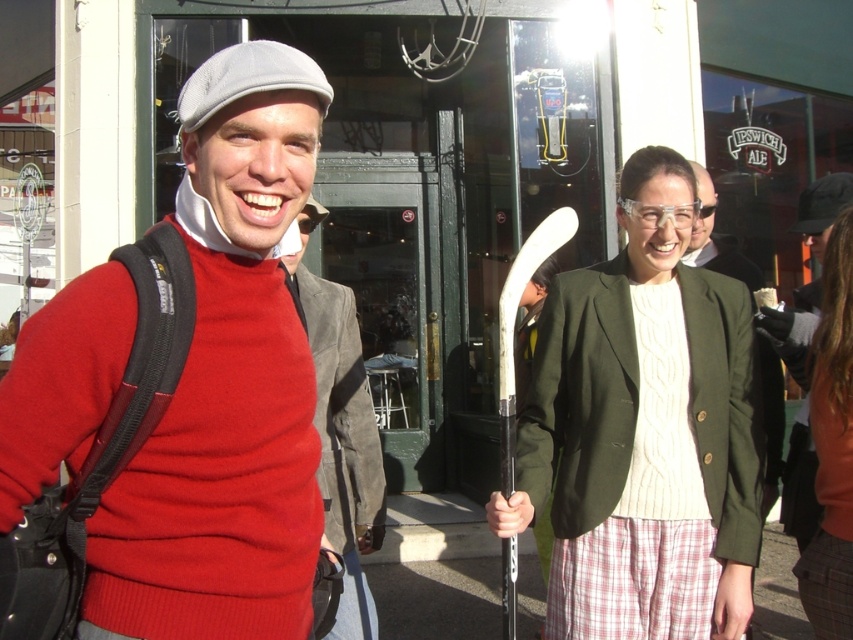
Question: Is red sweater at left in front of orange sweater at center?

Choices:
 (A) yes
 (B) no

Answer: (A)

Question: Which object appears farthest from the camera in this image?

Choices:
 (A) matte red sweater at center
 (B) green matte blazer at center

Answer: (B)

Question: Can you confirm if red sweater at left is bigger than green matte blazer at center?

Choices:
 (A) yes
 (B) no

Answer: (A)

Question: Which object is the farthest from the red sweater at left?

Choices:
 (A) white cable-knit sweater at center
 (B) green matte blazer at center
 (C) orange sweater at center

Answer: (B)

Question: Which point appears farthest from the camera in this image?

Choices:
 (A) (329, 339)
 (B) (839, 545)
 (C) (772, 396)

Answer: (C)

Question: Is orange sweater at center positioned at the back of green matte blazer at center?

Choices:
 (A) no
 (B) yes

Answer: (A)